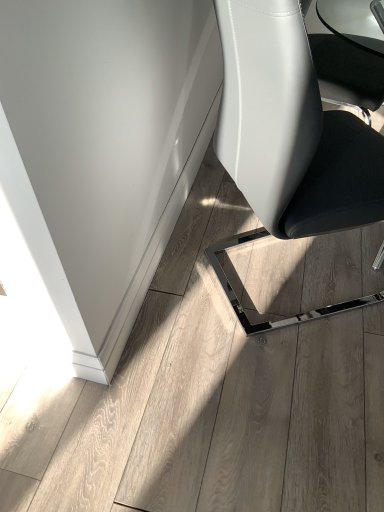
Where is `free spot below white leather chair at center (from a real-world perspective)`? This screenshot has height=512, width=384. free spot below white leather chair at center (from a real-world perspective) is located at coordinates (274, 284).